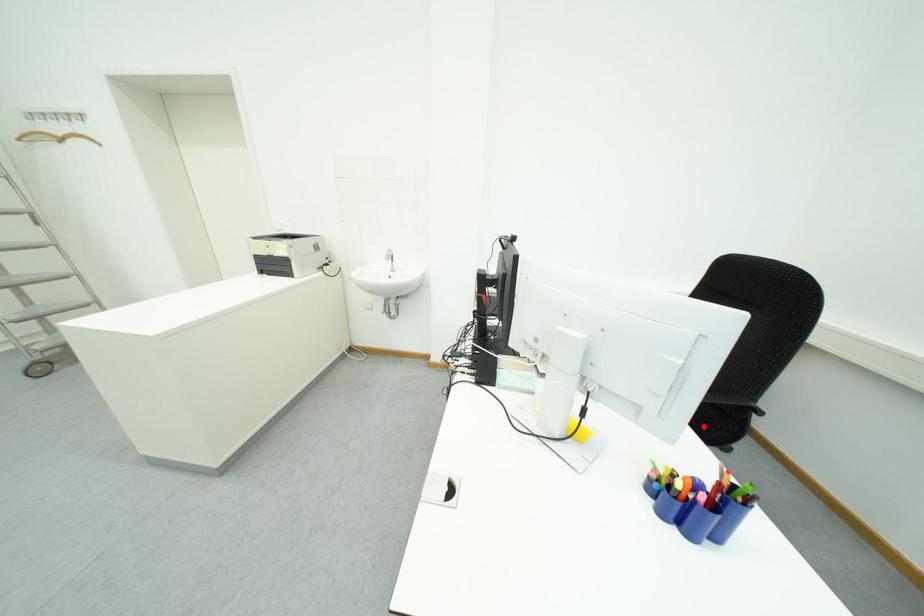
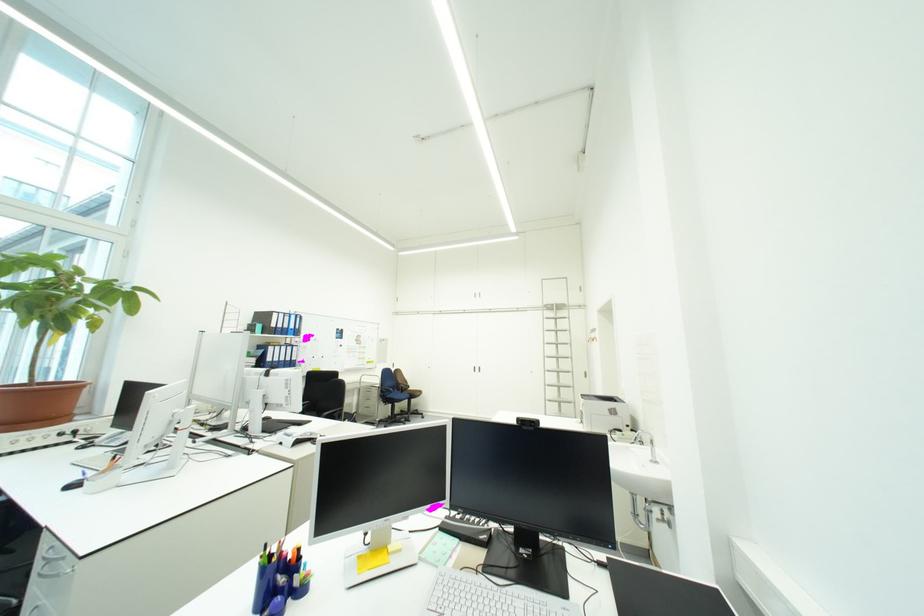
Question: I am providing you with two images of the same scene from different viewpoints. A red point is marked on the first image. Is the red point's position out of view in image 2?

Choices:
 (A) Yes
 (B) No

Answer: (A)